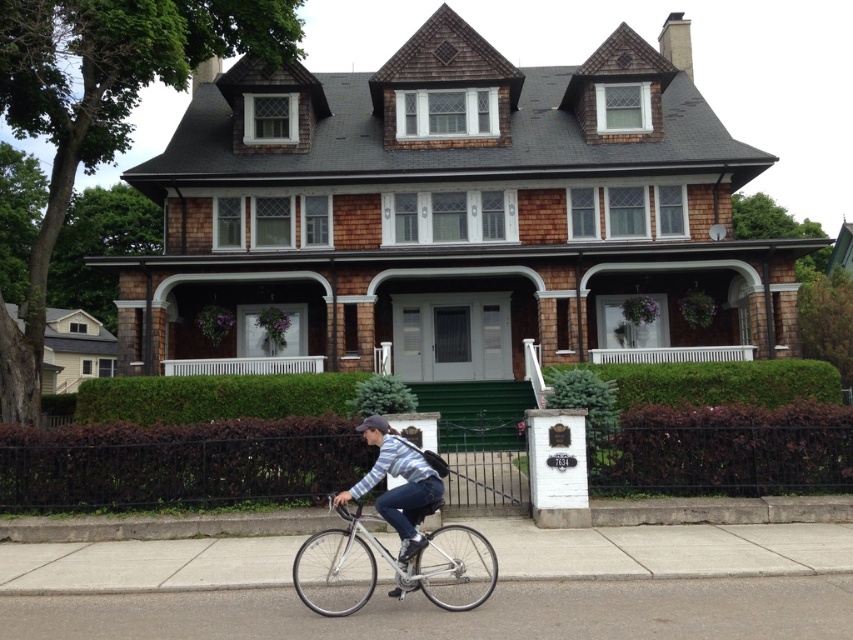
Who is shorter, silver metallic bicycle at lower center or striped cotton shirt at center?

silver metallic bicycle at lower center

Can you confirm if silver metallic bicycle at lower center is thinner than striped cotton shirt at center?

In fact, silver metallic bicycle at lower center might be wider than striped cotton shirt at center.

Image resolution: width=853 pixels, height=640 pixels. Find the location of `silver metallic bicycle at lower center`. silver metallic bicycle at lower center is located at coordinates (389, 564).